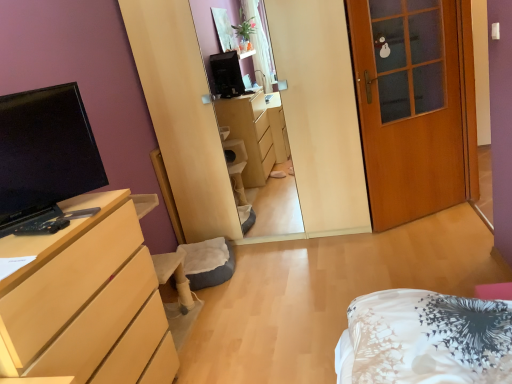
Question: Does light wood/finish dresser at left have a lesser height compared to wooden door at right?

Choices:
 (A) yes
 (B) no

Answer: (A)

Question: Does light wood/finish dresser at left have a lesser width compared to wooden door at right?

Choices:
 (A) no
 (B) yes

Answer: (A)

Question: Is light wood/finish dresser at left beside wooden door at right?

Choices:
 (A) no
 (B) yes

Answer: (A)

Question: Can you confirm if light wood/finish dresser at left is smaller than wooden door at right?

Choices:
 (A) no
 (B) yes

Answer: (A)

Question: Does light wood/finish dresser at left appear on the left side of wooden door at right?

Choices:
 (A) yes
 (B) no

Answer: (A)

Question: From a real-world perspective, is matte black tv at left above or below wooden door at right?

Choices:
 (A) below
 (B) above

Answer: (B)

Question: Is matte black tv at left spatially inside wooden door at right, or outside of it?

Choices:
 (A) inside
 (B) outside

Answer: (B)

Question: Is matte black tv at left in front of or behind wooden door at right in the image?

Choices:
 (A) behind
 (B) front

Answer: (B)

Question: Considering the positions of matte black tv at left and wooden door at right in the image, is matte black tv at left taller or shorter than wooden door at right?

Choices:
 (A) short
 (B) tall

Answer: (A)

Question: Is wooden door at right bigger or smaller than light wood/finish dresser at left?

Choices:
 (A) small
 (B) big

Answer: (A)

Question: Do you think wooden door at right is within light wood/finish dresser at left, or outside of it?

Choices:
 (A) inside
 (B) outside

Answer: (B)

Question: Considering the positions of wooden door at right and light wood/finish dresser at left in the image, is wooden door at right taller or shorter than light wood/finish dresser at left?

Choices:
 (A) short
 (B) tall

Answer: (B)

Question: Considering their positions, is wooden door at right located in front of or behind light wood/finish dresser at left?

Choices:
 (A) behind
 (B) front

Answer: (A)

Question: Is point (41, 155) closer or farther from the camera than point (153, 337)?

Choices:
 (A) closer
 (B) farther

Answer: (A)

Question: In terms of height, does matte black tv at left look taller or shorter compared to light wood/finish dresser at left?

Choices:
 (A) short
 (B) tall

Answer: (A)